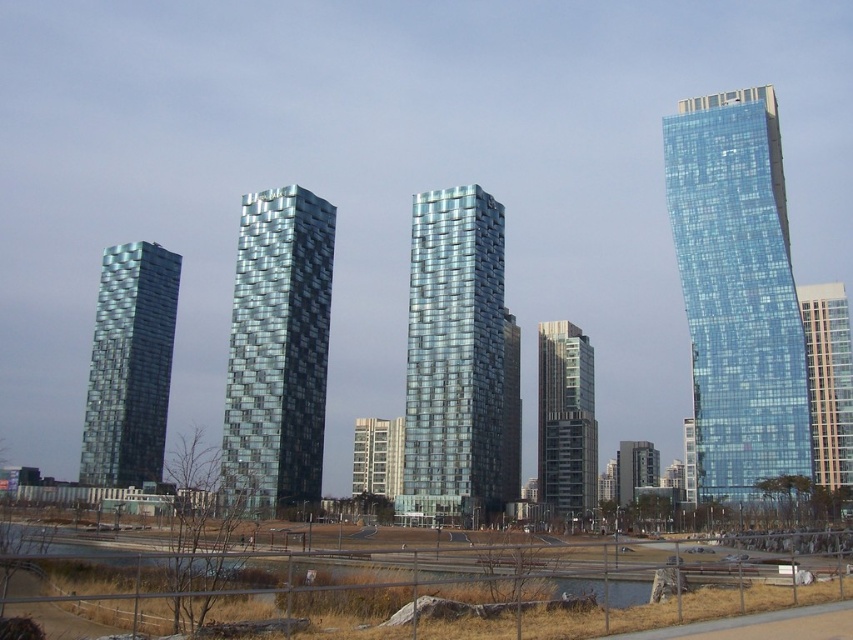
Is point (474, 304) farther from viewer compared to point (828, 403)?

No.

Can you confirm if shiny glass skyscraper at center is thinner than clear glass building at right?

Incorrect, shiny glass skyscraper at center's width is not less than clear glass building at right's.

Between point (479, 384) and point (838, 340), which one is positioned in front?

Point (479, 384) is more forward.

Identify the location of shiny glass skyscraper at center. Image resolution: width=853 pixels, height=640 pixels. (457, 364).

The image size is (853, 640). Describe the element at coordinates (828, 381) in the screenshot. I see `clear glass building at right` at that location.

Find the location of a particular element. The height and width of the screenshot is (640, 853). clear glass building at right is located at coordinates (828, 381).

Is point (425, 204) closer to camera compared to point (358, 445)?

Yes, point (425, 204) is in front of point (358, 445).

Does shiny glass skyscraper at center have a lesser height compared to white concrete building at center?

No, shiny glass skyscraper at center is not shorter than white concrete building at center.

This screenshot has width=853, height=640. Describe the element at coordinates (457, 364) in the screenshot. I see `shiny glass skyscraper at center` at that location.

I want to click on shiny glass skyscraper at center, so click(x=457, y=364).